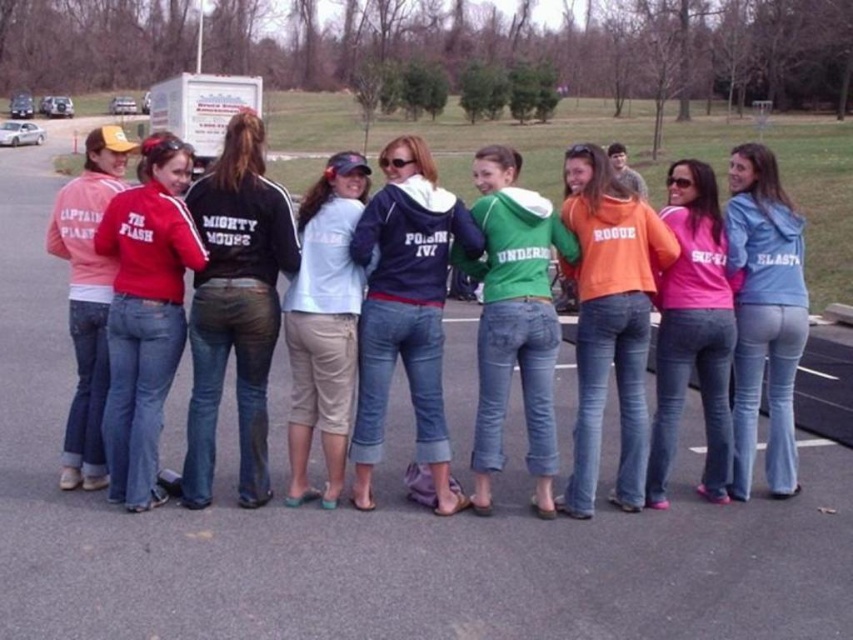
Which of these two, orange fleece jacket at center or blue denim jeans at right, stands taller?

blue denim jeans at right is taller.

Measure the distance between point (601, 280) and camera.

A distance of 5.00 meters exists between point (601, 280) and camera.

I want to click on orange fleece jacket at center, so click(x=608, y=321).

Does point (108, 340) lie in front of point (335, 292)?

Yes, point (108, 340) is in front of point (335, 292).

Looking at this image, between matte red jacket at center and light blue denim shorts at center, which one has more height?

Standing taller between the two is matte red jacket at center.

Identify the location of matte red jacket at center. (144, 314).

Between orange fleece jacket at center and light blue denim shorts at center, which one has more height?

light blue denim shorts at center

Does orange fleece jacket at center have a larger size compared to light blue denim shorts at center?

Incorrect, orange fleece jacket at center is not larger than light blue denim shorts at center.

Which is behind, point (624, 356) or point (329, 406)?

Point (624, 356)

This screenshot has height=640, width=853. I want to click on orange fleece jacket at center, so click(608, 321).